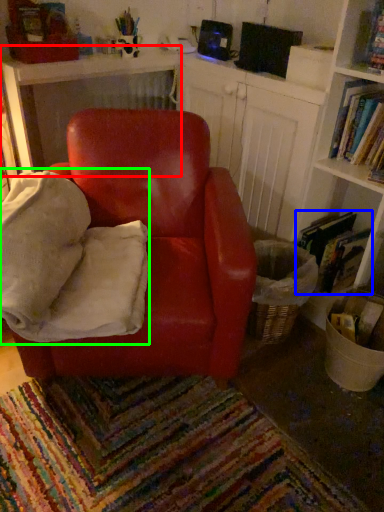
Question: Which object is the closest to the table (highlighted by a red box)? Choose among these: book (highlighted by a blue box) or bean bag chair (highlighted by a green box).

Choices:
 (A) book
 (B) bean bag chair

Answer: (B)